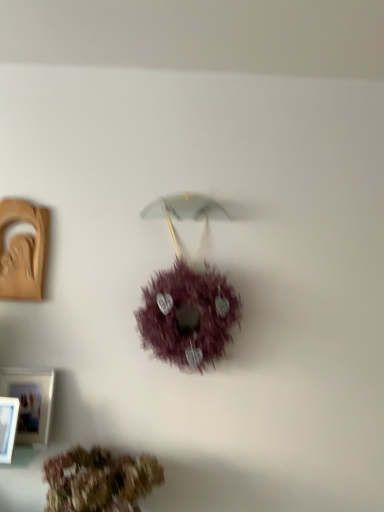
Question: Does white plastic picture frame at lower left, marked as the 3th picture frame in a top-to-bottom arrangement, have a lesser width compared to matte brown picture frame at left, which is counted as the 3th picture frame, starting from the bottom?

Choices:
 (A) yes
 (B) no

Answer: (B)

Question: Is white plastic picture frame at lower left, which ranks as the 1th picture frame in front-to-back order, not near matte brown picture frame at left, the 1th picture frame positioned from the top?

Choices:
 (A) no
 (B) yes

Answer: (A)

Question: Does white plastic picture frame at lower left, which is the third picture frame from back to front, appear on the right side of matte brown picture frame at left, the 1th picture frame in the back-to-front sequence?

Choices:
 (A) no
 (B) yes

Answer: (B)

Question: Is white plastic picture frame at lower left, the first picture frame when ordered from bottom to top, not inside matte brown picture frame at left, the 1th picture frame positioned from the top?

Choices:
 (A) yes
 (B) no

Answer: (A)

Question: Considering the relative sizes of white plastic picture frame at lower left, which ranks as the 1th picture frame in front-to-back order, and matte brown picture frame at left, the 1th picture frame in the back-to-front sequence, in the image provided, is white plastic picture frame at lower left, which ranks as the 1th picture frame in front-to-back order, smaller than matte brown picture frame at left, the 1th picture frame in the back-to-front sequence,?

Choices:
 (A) no
 (B) yes

Answer: (B)

Question: From a real-world perspective, is white plastic picture frame at lower left, marked as the 3th picture frame in a top-to-bottom arrangement, positioned over matte brown picture frame at left, which is counted as the 3th picture frame, starting from the bottom, based on gravity?

Choices:
 (A) yes
 (B) no

Answer: (B)

Question: Is white plastic picture frame at lower left, the first picture frame when ordered from bottom to top, to the right of purple fluffy wreath at center, the second flower ordered from the bottom, from the viewer's perspective?

Choices:
 (A) yes
 (B) no

Answer: (B)

Question: Could you tell me if white plastic picture frame at lower left, marked as the 3th picture frame in a top-to-bottom arrangement, is turned towards purple fluffy wreath at center, the second flower ordered from the bottom?

Choices:
 (A) yes
 (B) no

Answer: (B)

Question: Is purple fluffy wreath at center, the second flower ordered from the bottom, located within white plastic picture frame at lower left, marked as the 3th picture frame in a top-to-bottom arrangement?

Choices:
 (A) no
 (B) yes

Answer: (A)

Question: From the image's perspective, is white plastic picture frame at lower left, marked as the 3th picture frame in a top-to-bottom arrangement, below purple fluffy wreath at center, the second flower ordered from the bottom?

Choices:
 (A) no
 (B) yes

Answer: (B)

Question: From the image's perspective, is white plastic picture frame at lower left, the first picture frame when ordered from bottom to top, above purple fluffy wreath at center, the second flower ordered from the bottom?

Choices:
 (A) no
 (B) yes

Answer: (A)

Question: From a real-world perspective, is white plastic picture frame at lower left, marked as the 3th picture frame in a top-to-bottom arrangement, physically above purple fluffy wreath at center, which is counted as the 1th flower, starting from the top?

Choices:
 (A) yes
 (B) no

Answer: (B)

Question: Is the position of purple fluffy wreath at center, the second flower ordered from the bottom, more distant than that of matte brown picture frame at left, the 1th picture frame in the back-to-front sequence?

Choices:
 (A) no
 (B) yes

Answer: (A)